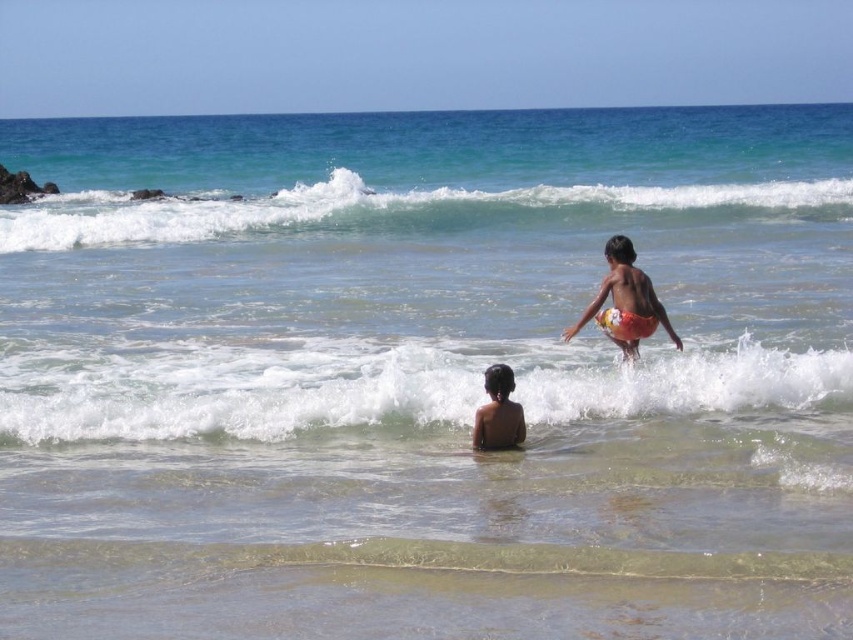
You are standing on the beach and see the white frothy wave at center approaching. If you can run at 5 feet per second, how many seconds do you have before the wave reaches you?

The white frothy wave at center is 44.90 feet away from viewer. At a running speed of 5 feet per second, you would have approximately 8.98 seconds before the wave reaches you.

In the scene shown: You are a parent watching your children at the beach. You see the white frothy wave at center and the brown skin at lower center. Which one is closer to you?

The brown skin at lower center is closer to you because the white frothy wave at center is further away.